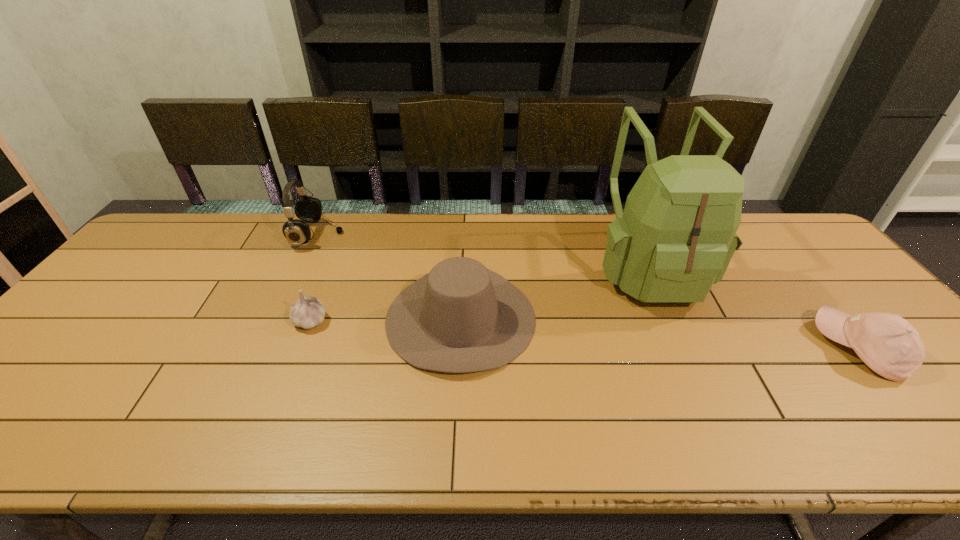
Find the location of a particular element. backpack is located at coordinates (675, 239).

Find the location of a particular element. Image resolution: width=960 pixels, height=540 pixels. the second object from right to left is located at coordinates (675, 239).

The width and height of the screenshot is (960, 540). I want to click on headset, so click(x=308, y=209).

Find the location of a particular element. cowboy hat is located at coordinates (461, 317).

Where is `the third tallest object`? This screenshot has height=540, width=960. the third tallest object is located at coordinates (461, 317).

Find the location of a particular element. This screenshot has height=540, width=960. baseball cap is located at coordinates (888, 344).

Image resolution: width=960 pixels, height=540 pixels. What are the coordinates of `garlic` in the screenshot? It's located at (308, 312).

The height and width of the screenshot is (540, 960). What are the coordinates of `vacant point located 0.370m on the front pocket of the fourth object from left to right` in the screenshot? It's located at (730, 450).

Where is `vacant space located with the microphone on the side of the second tallest object`? This screenshot has height=540, width=960. vacant space located with the microphone on the side of the second tallest object is located at coordinates (452, 236).

Identify the location of vacant space located 0.080m on the front of the cowboy hat. (456, 410).